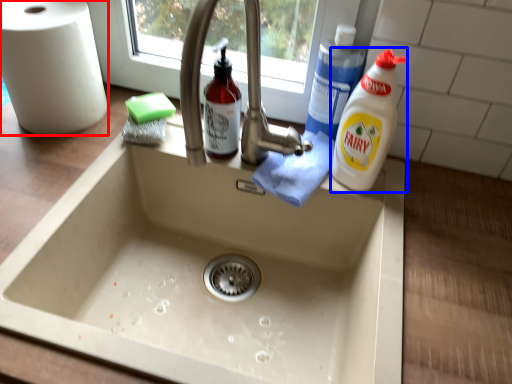
Question: Which point is further to the camera, paper towel (highlighted by a red box) or cleaning product (highlighted by a blue box)?

Choices:
 (A) paper towel
 (B) cleaning product

Answer: (A)